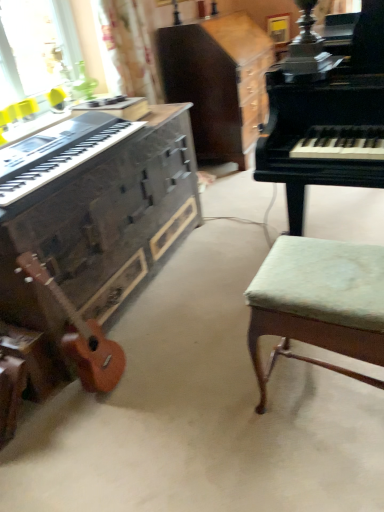
This screenshot has width=384, height=512. In order to click on vacant space situated on the left part of green fabric stool at right in this screenshot , I will do `click(224, 415)`.